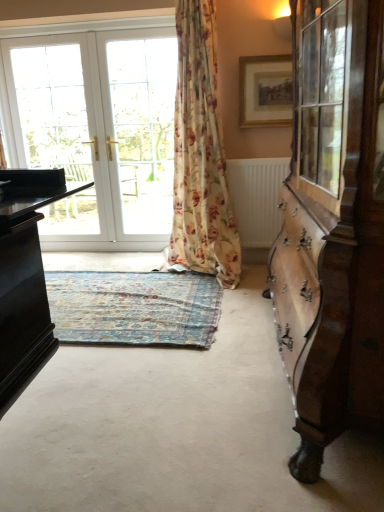
Question: Can you confirm if floral fabric curtain at center is taller than blue floral rug at center?

Choices:
 (A) yes
 (B) no

Answer: (A)

Question: Is floral fabric curtain at center to the left of blue floral rug at center from the viewer's perspective?

Choices:
 (A) no
 (B) yes

Answer: (A)

Question: Can you confirm if floral fabric curtain at center is smaller than blue floral rug at center?

Choices:
 (A) no
 (B) yes

Answer: (A)

Question: Could you tell me if floral fabric curtain at center is turned towards blue floral rug at center?

Choices:
 (A) no
 (B) yes

Answer: (A)

Question: Does floral fabric curtain at center come in front of blue floral rug at center?

Choices:
 (A) yes
 (B) no

Answer: (B)

Question: From a real-world perspective, is blue floral rug at center physically located above or below floral fabric curtain at center?

Choices:
 (A) below
 (B) above

Answer: (A)

Question: Is blue floral rug at center situated inside floral fabric curtain at center or outside?

Choices:
 (A) inside
 (B) outside

Answer: (B)

Question: From their relative heights in the image, would you say blue floral rug at center is taller or shorter than floral fabric curtain at center?

Choices:
 (A) tall
 (B) short

Answer: (B)

Question: Is blue floral rug at center in front of or behind floral fabric curtain at center in the image?

Choices:
 (A) front
 (B) behind

Answer: (A)

Question: In terms of size, does gold-framed picture at upper center appear bigger or smaller than white textured radiator at center?

Choices:
 (A) big
 (B) small

Answer: (B)

Question: Is gold-framed picture at upper center situated inside white textured radiator at center or outside?

Choices:
 (A) inside
 (B) outside

Answer: (B)

Question: Considering the positions of gold-framed picture at upper center and white textured radiator at center in the image, is gold-framed picture at upper center wider or thinner than white textured radiator at center?

Choices:
 (A) thin
 (B) wide

Answer: (A)

Question: Considering their positions, is gold-framed picture at upper center located in front of or behind white textured radiator at center?

Choices:
 (A) front
 (B) behind

Answer: (A)

Question: Is blue floral rug at center situated inside white textured radiator at center or outside?

Choices:
 (A) outside
 (B) inside

Answer: (A)

Question: In terms of width, does blue floral rug at center look wider or thinner when compared to white textured radiator at center?

Choices:
 (A) thin
 (B) wide

Answer: (B)